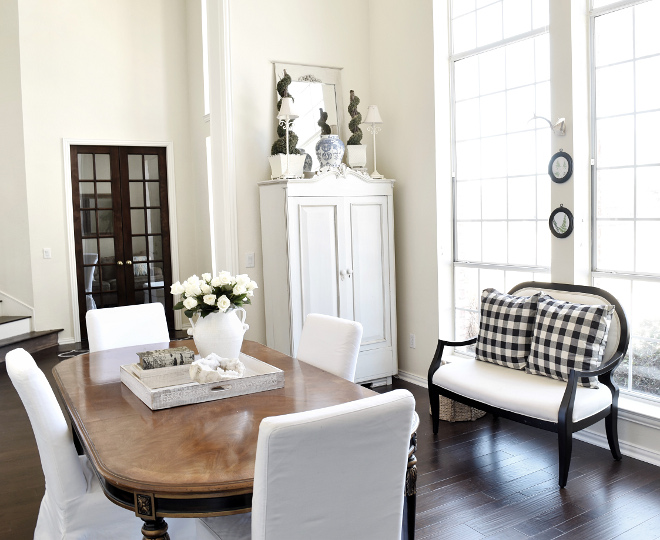
You are a GUI agent. You are given a task and a screenshot of the screen. Output one action in this format:
    pyautogui.click(x=<x>, y=<y>)
    Task: Click on the picture
    
    Given the screenshot: What is the action you would take?
    pyautogui.click(x=554, y=217)